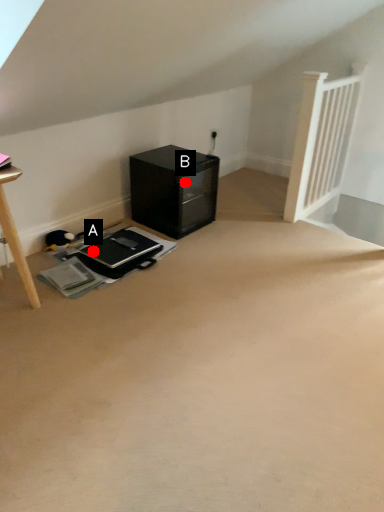
Question: Two points are circled on the image, labeled by A and B beside each circle. Which point appears closest to the camera in this image?

Choices:
 (A) A is closer
 (B) B is closer

Answer: (A)